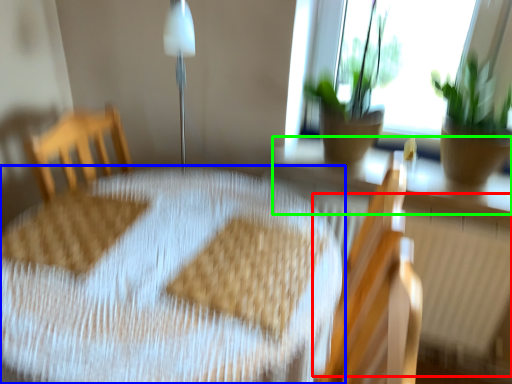
Question: Which object is positioned closest to radiator (highlighted by a red box)? Select from table (highlighted by a blue box) and window sill (highlighted by a green box).

Choices:
 (A) table
 (B) window sill

Answer: (B)